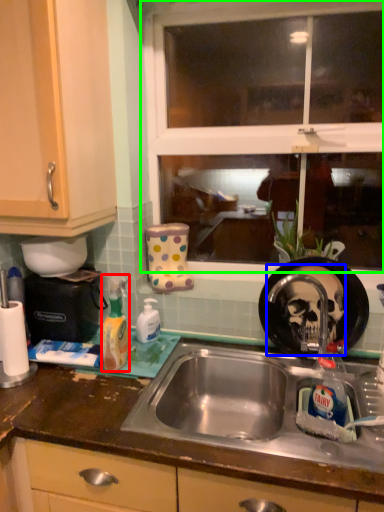
Question: Which object is the farthest from cleaning product (highlighted by a red box)? Choose among these: tap (highlighted by a blue box) or window (highlighted by a green box).

Choices:
 (A) tap
 (B) window

Answer: (B)